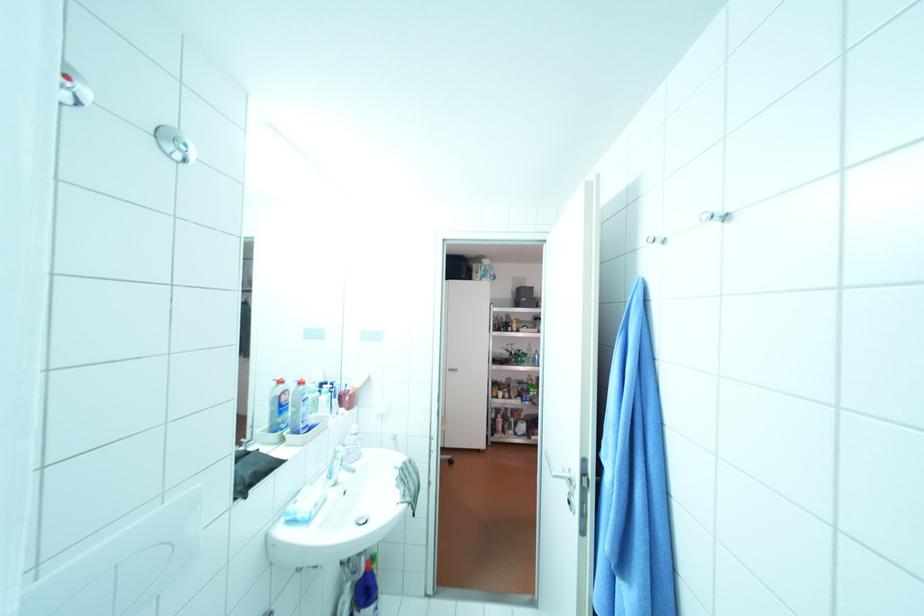
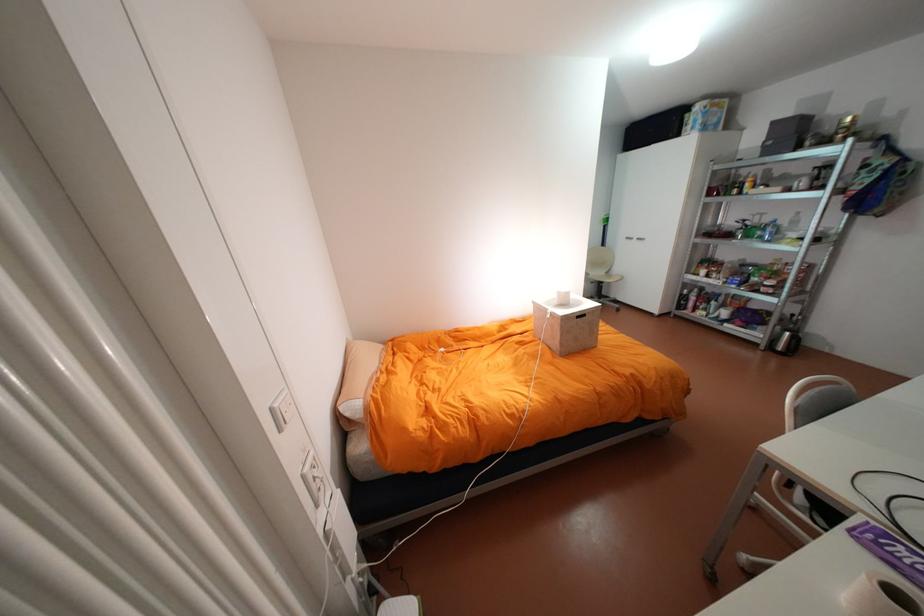
Locate, in the second image, the point that corresponds to point (525, 347) in the first image.

(775, 219)